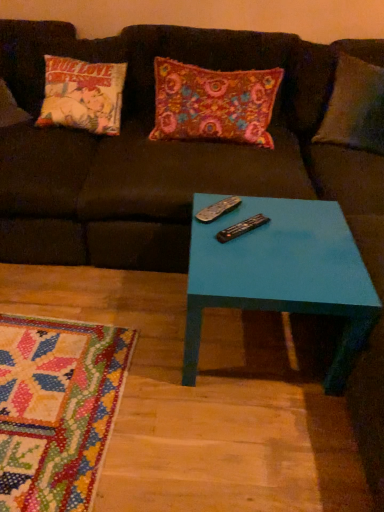
Find the location of a particular element. The image size is (384, 512). free spot in front of black plastic remote at center, the 2th remote in the back-to-front sequence is located at coordinates (244, 264).